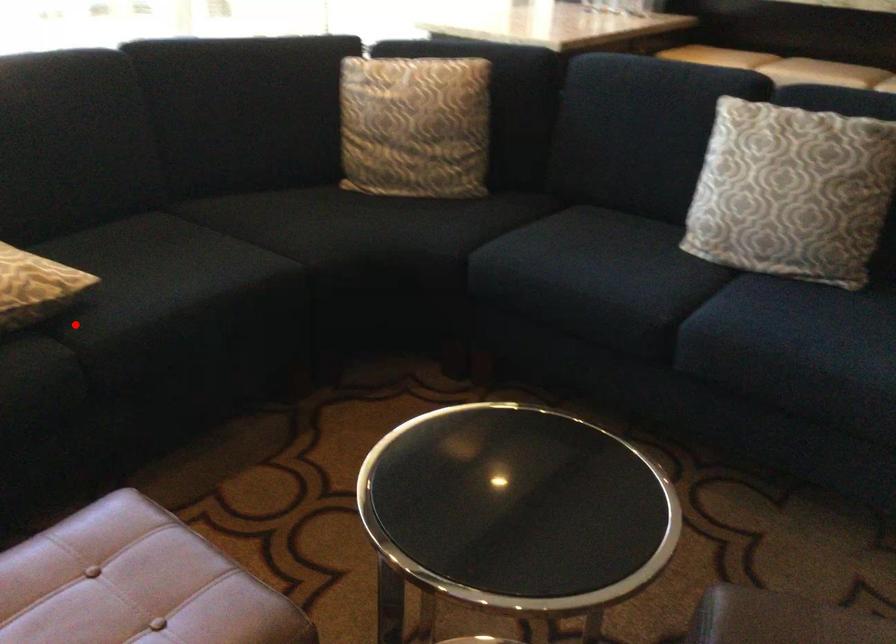
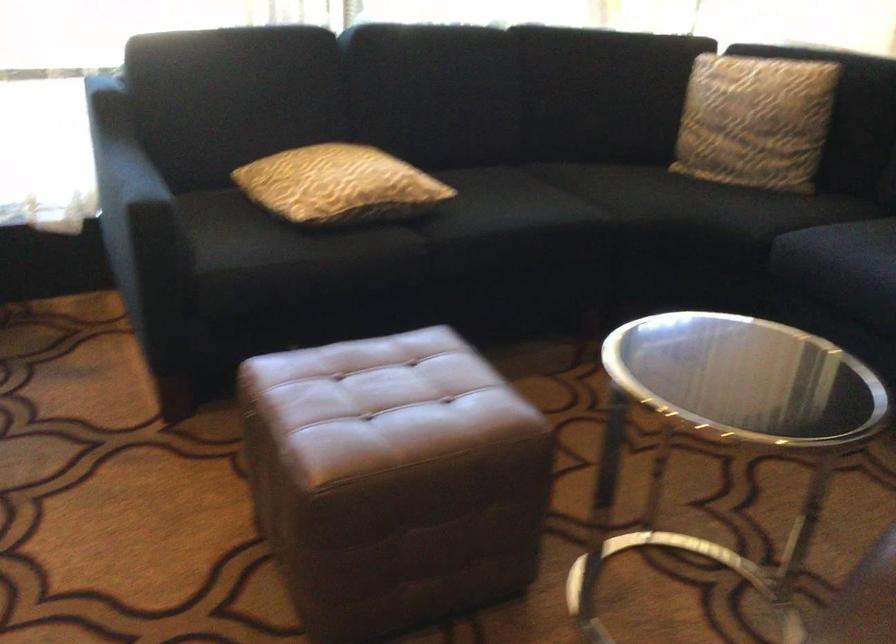
Find the pixel in the second image that matches the highlighted location in the first image.

(426, 227)